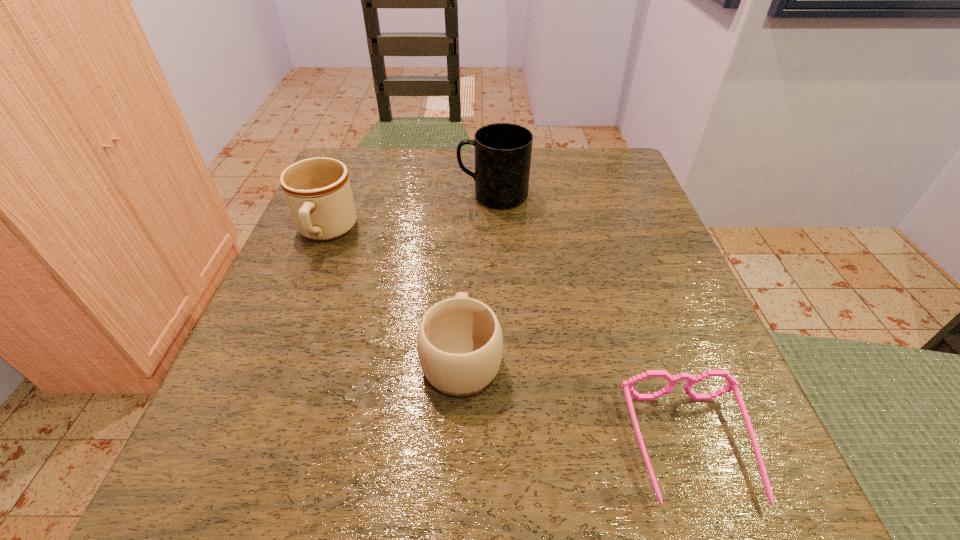
At what (x,y) coordinates should I click in order to perform the action: click on object that is at the far edge. Please return your answer as a coordinate pair (x, y). Looking at the image, I should click on (503, 151).

Find the location of a particular element. object positioned at the near edge is located at coordinates 627,386.

The height and width of the screenshot is (540, 960). I want to click on object present at the left edge, so [x=318, y=192].

Identify the location of object that is at the right edge. The image size is (960, 540). pos(627,386).

I want to click on object that is at the near right corner, so click(x=627, y=386).

You are a GUI agent. You are given a task and a screenshot of the screen. Output one action in this format:
    pyautogui.click(x=<x>, y=<y>)
    Task: Click on the vacant region at the far edge
    
    Given the screenshot: What is the action you would take?
    pyautogui.click(x=417, y=156)

Locate an element on the screen. This screenshot has width=960, height=540. vacant space at the near edge of the desktop is located at coordinates (630, 460).

Locate an element on the screen. The height and width of the screenshot is (540, 960). free point at the left edge is located at coordinates (365, 253).

In the image, there is a desktop. Where is `free region at the right edge`? The width and height of the screenshot is (960, 540). free region at the right edge is located at coordinates (624, 293).

Where is `vacant point at the far left corner`? The width and height of the screenshot is (960, 540). vacant point at the far left corner is located at coordinates (349, 170).